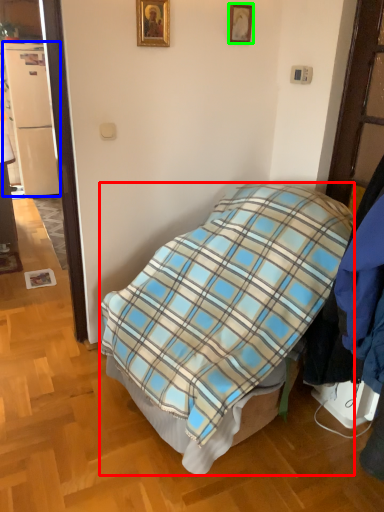
Question: Which object is positioned closest to bed (highlighted by a red box)? Select from refrigerator (highlighted by a blue box) and picture frame (highlighted by a green box).

Choices:
 (A) refrigerator
 (B) picture frame

Answer: (B)